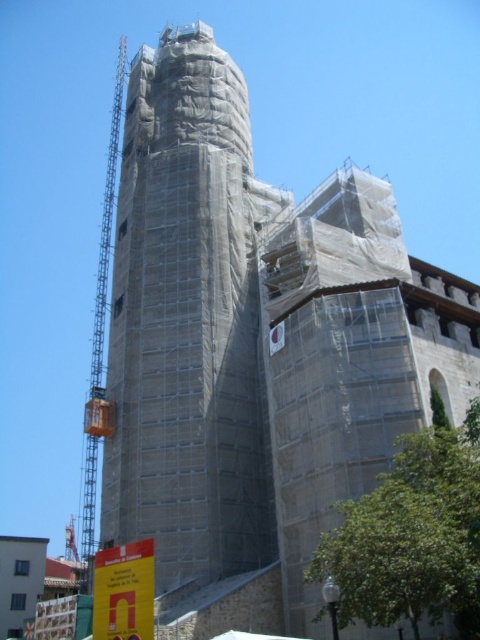
Does gray concrete tower at center appear over orange metallic crane at left?

Correct, gray concrete tower at center is located above orange metallic crane at left.

Does gray concrete tower at center have a greater width compared to orange metallic crane at left?

Incorrect, gray concrete tower at center's width does not surpass orange metallic crane at left's.

Does point (171, 392) come farther from viewer compared to point (104, 193)?

No, (171, 392) is in front of (104, 193).

Identify the location of gray concrete tower at center. The image size is (480, 640). (188, 321).